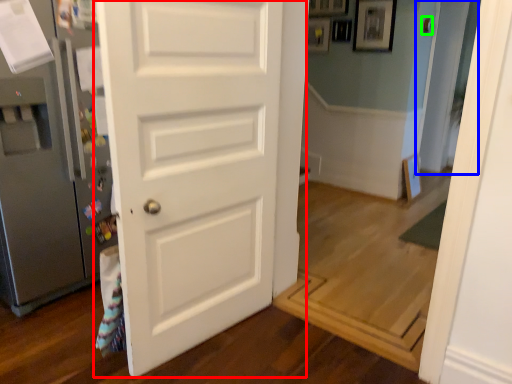
Question: Considering the real-world distances, which object is farthest from door (highlighted by a red box)? glass door (highlighted by a blue box) or door handle (highlighted by a green box)?

Choices:
 (A) glass door
 (B) door handle

Answer: (A)